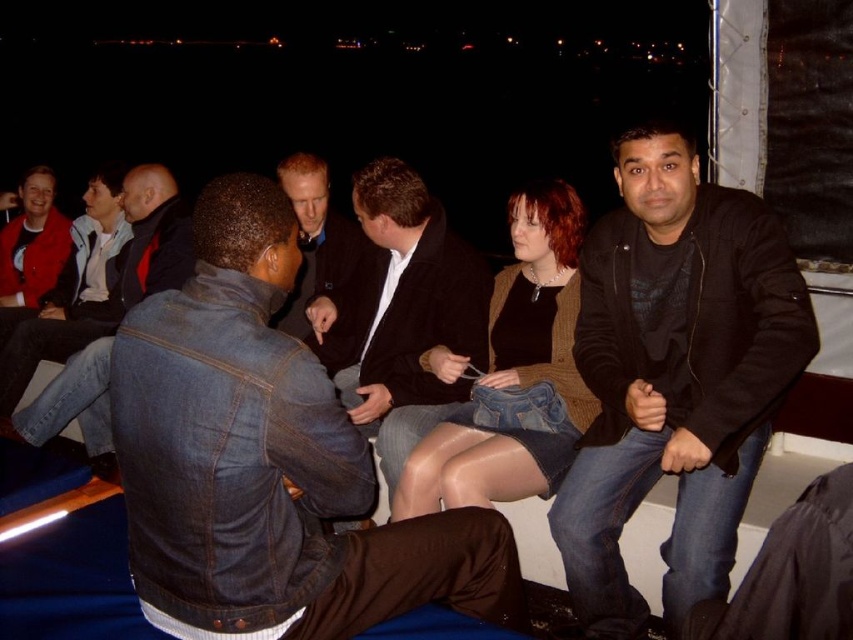
Question: Is jeans at left closer to camera compared to smooth brown jacket at center?

Choices:
 (A) no
 (B) yes

Answer: (B)

Question: From the image, what is the correct spatial relationship of black leather jacket at right in relation to dark brown leather jacket at center?

Choices:
 (A) below
 (B) above

Answer: (A)

Question: Which object is closer to the camera taking this photo?

Choices:
 (A) shiny brown jacket at center
 (B) denim jacket at lower right
 (C) matte red jacket at left

Answer: (B)

Question: Does black leather jacket at right have a larger size compared to jeans at left?

Choices:
 (A) no
 (B) yes

Answer: (A)

Question: Which object is closer to the camera taking this photo?

Choices:
 (A) denim jacket at lower right
 (B) dark brown leather jacket at center
 (C) smooth brown jacket at center

Answer: (A)

Question: Based on their relative distances, which object is nearer to the jeans at left?

Choices:
 (A) dark brown leather jacket at center
 (B) matte red jacket at left
 (C) denim jacket at lower right
 (D) black leather jacket at right

Answer: (B)